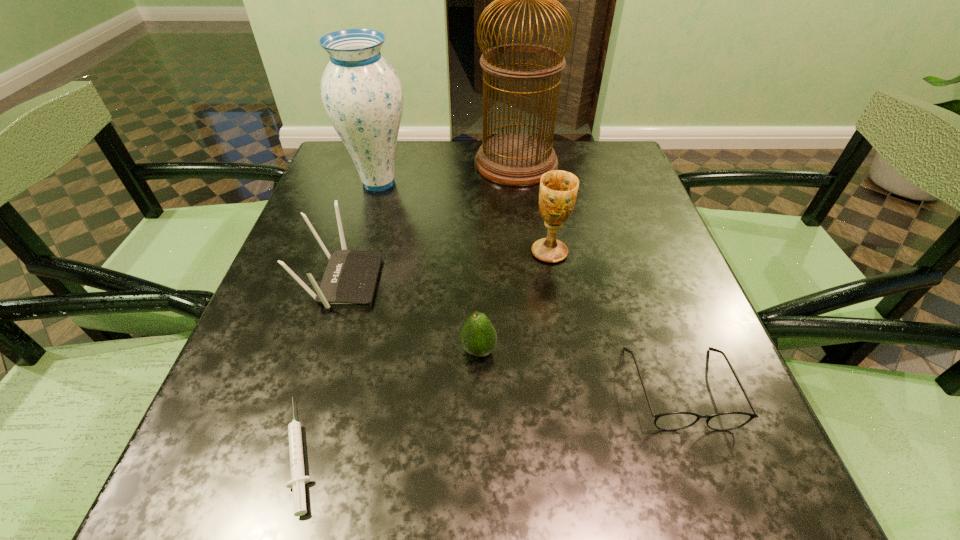
Find the location of `birdcage`. birdcage is located at coordinates (515, 159).

Locate an element on the screen. This screenshot has width=960, height=540. vase is located at coordinates (362, 95).

The height and width of the screenshot is (540, 960). In order to click on the third tallest object in this screenshot , I will do `click(558, 190)`.

Find the location of a particular element. The width and height of the screenshot is (960, 540). router is located at coordinates (350, 277).

The image size is (960, 540). In order to click on the fifth tallest object in this screenshot , I will do `click(478, 336)`.

Where is `the rightmost object`? the rightmost object is located at coordinates (671, 421).

Find the location of `the second shortest object`. the second shortest object is located at coordinates (671, 421).

Where is `the shortest object`? This screenshot has width=960, height=540. the shortest object is located at coordinates (298, 480).

The image size is (960, 540). In order to click on free region located 0.390m on the front-facing side of the tallest object in this screenshot , I will do `click(326, 163)`.

Locate an element on the screen. The height and width of the screenshot is (540, 960). vacant area situated on the front-facing side of the tallest object is located at coordinates (429, 163).